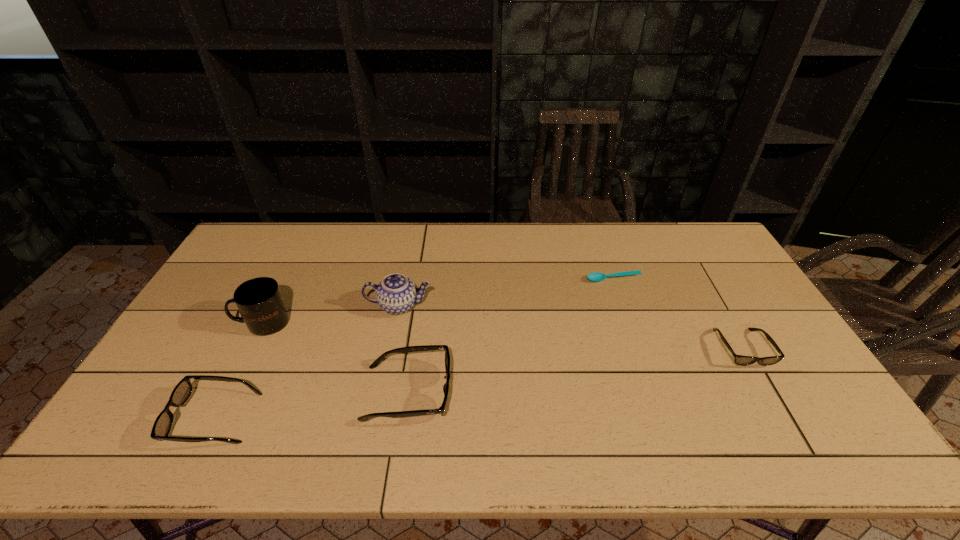
Find the location of a particular element. The image size is (960, 540). the second tallest spectacles is located at coordinates (182, 391).

Image resolution: width=960 pixels, height=540 pixels. Identify the location of the fourth tallest object. (182, 391).

What are the coordinates of `the second spectacles from right to left` in the screenshot? It's located at (441, 410).

At what (x,y) coordinates should I click in order to perform the action: click on the fourth shortest object. Please return your answer as a coordinate pair (x, y). The image size is (960, 540). Looking at the image, I should click on (441, 410).

This screenshot has width=960, height=540. I want to click on the rightmost spectacles, so click(x=738, y=359).

The height and width of the screenshot is (540, 960). Identify the location of the rightmost object. (738, 359).

This screenshot has width=960, height=540. Identify the location of mug. (260, 302).

Image resolution: width=960 pixels, height=540 pixels. What are the coordinates of `spoon` in the screenshot? It's located at (596, 276).

This screenshot has height=540, width=960. What are the coordinates of `the farthest object` in the screenshot? It's located at (596, 276).

Image resolution: width=960 pixels, height=540 pixels. In order to click on chinaware in this screenshot , I will do `click(396, 294)`.